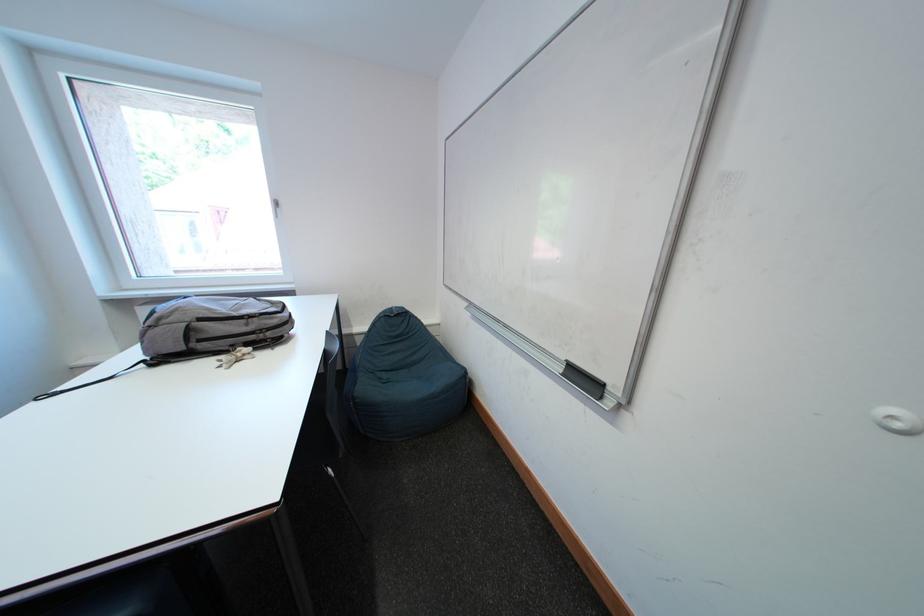
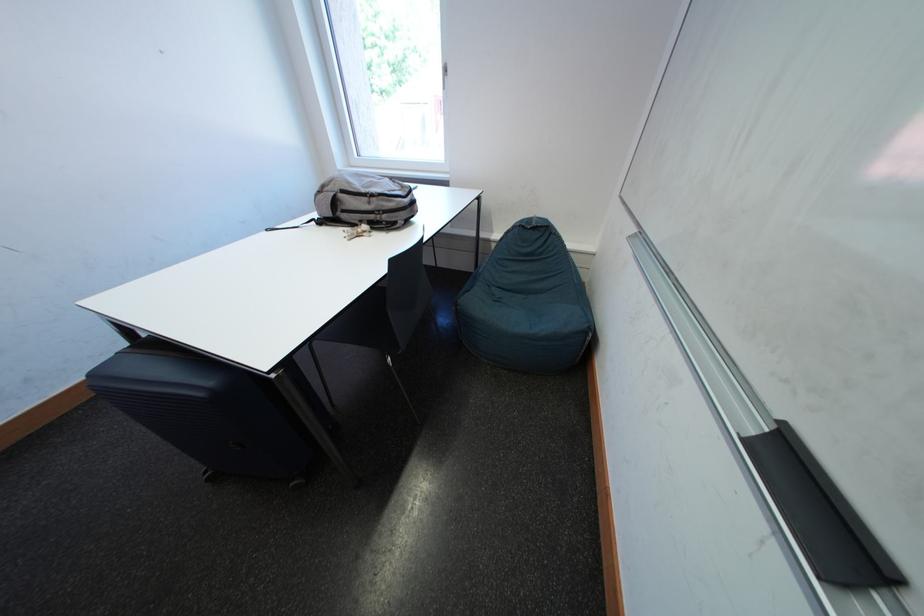
Locate, in the second image, the point that corresponds to the point at 355,354 in the first image.

(490, 259)